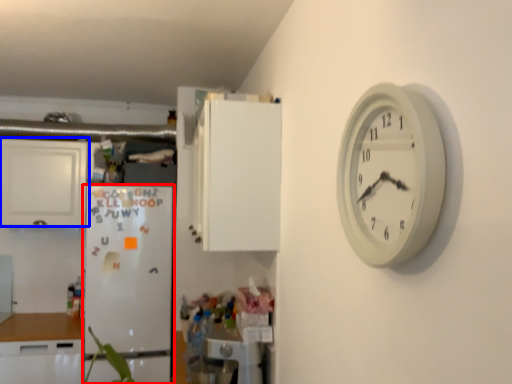
Question: Which of the following is the farthest to the observer, fridge (highlighted by a red box) or cabinetry (highlighted by a blue box)?

Choices:
 (A) fridge
 (B) cabinetry

Answer: (B)